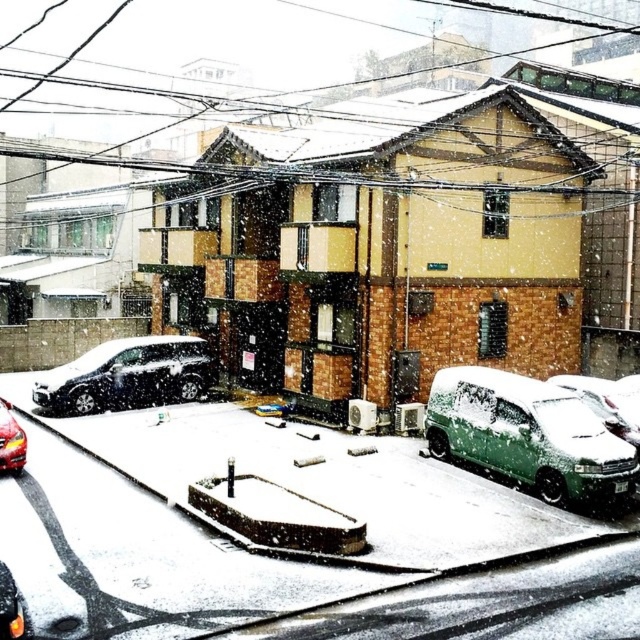
You are a delivery driver who needs to park your truck next to the shiny black sedan at left and the green matte van at lower right. Based on their sizes, which vehicle should you park closer to in order to maximize space efficiency?

The shiny black sedan at left has a smaller size compared to the green matte van at lower right, so you should park closer to the shiny black sedan at left to maximize space efficiency.

You are inside a car and looking out the windshield. You see a point marked at coordinates (605, 403). Based on the scene, can you tell me what object this point is located on?

The point marked at coordinates (605, 403) is located on the green matte van at lower right.

You are sitting in the driver seat of a car parked in the snowy parking lot. You notice two points marked in the scene. The first point is at coordinate point(168, 371) and the second is at point(637, 392). From your perspective inside the vehicle, which point is closer to you?

Point(168, 371) is behind point(637, 392), so the point closer to you is point(637, 392).